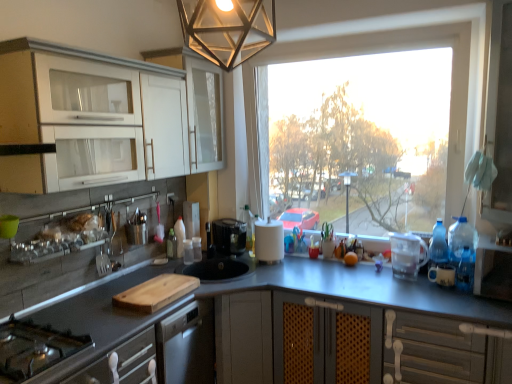
Image resolution: width=512 pixels, height=384 pixels. I want to click on free location in front of satin silver cutlery at left, so click(92, 289).